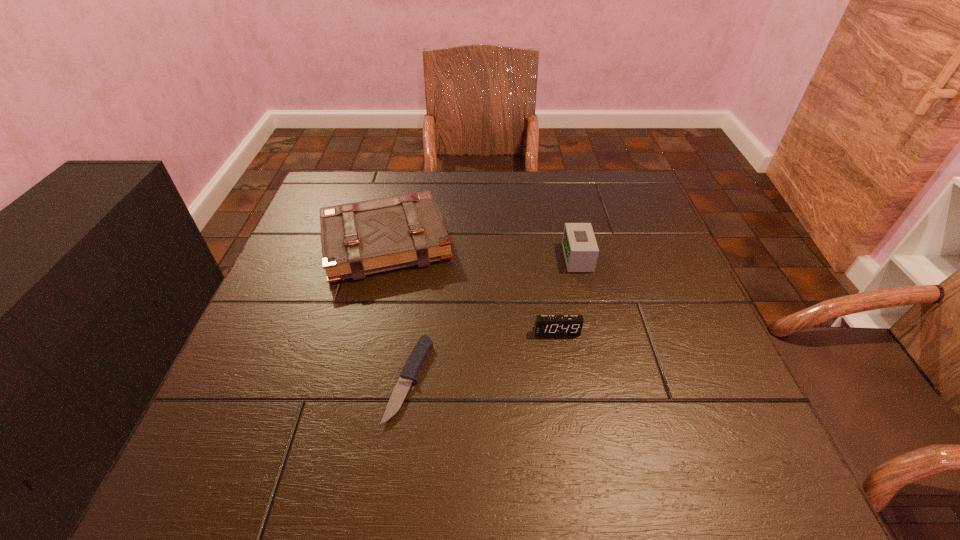
Where is `vacant space situated on the front-facing side of the taller alarm clock`? The image size is (960, 540). vacant space situated on the front-facing side of the taller alarm clock is located at coordinates (401, 258).

Where is `vacant position located 0.060m on the front-facing side of the left alarm clock`? vacant position located 0.060m on the front-facing side of the left alarm clock is located at coordinates (562, 360).

At what (x,y) coordinates should I click in order to perform the action: click on vacant space situated 0.190m on the left of the shortest object. Please return your answer as a coordinate pair (x, y). The width and height of the screenshot is (960, 540). Looking at the image, I should click on (288, 379).

You are a GUI agent. You are given a task and a screenshot of the screen. Output one action in this format:
    pyautogui.click(x=<x>, y=<y>)
    Task: Click on the object that is at the far edge
    This screenshot has height=540, width=960.
    Given the screenshot: What is the action you would take?
    pyautogui.click(x=360, y=238)

Where is `object situated at the left edge`? Image resolution: width=960 pixels, height=540 pixels. object situated at the left edge is located at coordinates (360, 238).

Find the location of a particular element. The height and width of the screenshot is (540, 960). object positioned at the far left corner is located at coordinates (360, 238).

In the image, there is a desktop. Where is `vacant space at the far edge`? This screenshot has height=540, width=960. vacant space at the far edge is located at coordinates (430, 179).

I want to click on vacant space at the near edge of the desktop, so click(x=551, y=455).

This screenshot has height=540, width=960. In the image, there is a desktop. What are the coordinates of `vacant space at the left edge` in the screenshot? It's located at (293, 251).

Where is `vacant space at the right edge`? Image resolution: width=960 pixels, height=540 pixels. vacant space at the right edge is located at coordinates (654, 301).